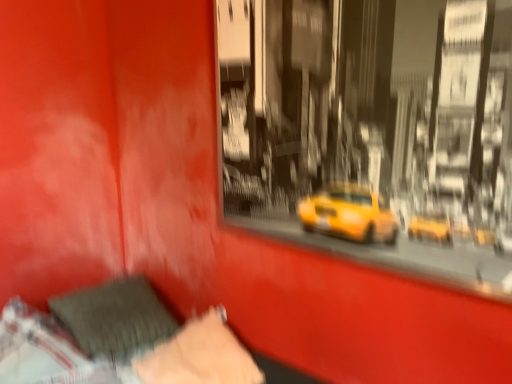
The width and height of the screenshot is (512, 384). What do you see at coordinates (118, 341) in the screenshot?
I see `velvet-like gray pillow at lower left` at bounding box center [118, 341].

Measure the distance between velvety black pillow at lower left, positioned as the first pillow in right-to-left order, and camera.

velvety black pillow at lower left, positioned as the first pillow in right-to-left order, is 1.43 meters from camera.

What do you see at coordinates (200, 356) in the screenshot?
I see `velvety black pillow at lower left, positioned as the first pillow in right-to-left order` at bounding box center [200, 356].

I want to click on velvety gray pillow at lower left, positioned as the first pillow in left-to-right order, so click(115, 317).

Is velvety black pillow at lower left, positioned as the first pillow in right-to-left order, completely or partially outside of velvet-like gray pillow at lower left?

No, velvety black pillow at lower left, positioned as the first pillow in right-to-left order, is inside velvet-like gray pillow at lower left's boundary.

Looking at this image, how many degrees apart are the facing directions of velvety black pillow at lower left, marked as the 2th pillow in a left-to-right arrangement, and velvet-like gray pillow at lower left?

The angle between the facing direction of velvety black pillow at lower left, marked as the 2th pillow in a left-to-right arrangement, and the facing direction of velvet-like gray pillow at lower left is 81.2 degrees.

Is velvety black pillow at lower left, marked as the 2th pillow in a left-to-right arrangement, in front of or behind velvet-like gray pillow at lower left in the image?

Clearly, velvety black pillow at lower left, marked as the 2th pillow in a left-to-right arrangement, is behind velvet-like gray pillow at lower left.

From the image's perspective, who appears lower, velvety black pillow at lower left, positioned as the first pillow in right-to-left order, or velvet-like gray pillow at lower left?

velvet-like gray pillow at lower left is shown below in the image.

Is velvety gray pillow at lower left, the second pillow in the right-to-left sequence, placed right next to velvety black pillow at lower left, positioned as the first pillow in right-to-left order?

No, velvety gray pillow at lower left, the second pillow in the right-to-left sequence, is not beside velvety black pillow at lower left, positioned as the first pillow in right-to-left order.

Consider the image. Which is in front, velvety gray pillow at lower left, the second pillow in the right-to-left sequence, or velvety black pillow at lower left, marked as the 2th pillow in a left-to-right arrangement?

velvety black pillow at lower left, marked as the 2th pillow in a left-to-right arrangement, is closer to the camera.

Is point (155, 322) behind point (255, 378)?

Yes, point (155, 322) is behind point (255, 378).

Between velvety gray pillow at lower left, the second pillow in the right-to-left sequence, and velvety black pillow at lower left, marked as the 2th pillow in a left-to-right arrangement, which one appears on the right side from the viewer's perspective?

velvety black pillow at lower left, marked as the 2th pillow in a left-to-right arrangement, is more to the right.

In the scene shown: Is velvet-like gray pillow at lower left oriented towards velvety gray pillow at lower left, positioned as the first pillow in left-to-right order?

No, velvet-like gray pillow at lower left is not turned towards velvety gray pillow at lower left, positioned as the first pillow in left-to-right order.

Between velvet-like gray pillow at lower left and velvety gray pillow at lower left, the second pillow in the right-to-left sequence, which one has smaller width?

velvety gray pillow at lower left, the second pillow in the right-to-left sequence, is thinner.

Is velvet-like gray pillow at lower left at the right side of velvety gray pillow at lower left, positioned as the first pillow in left-to-right order?

Yes, velvet-like gray pillow at lower left is to the right of velvety gray pillow at lower left, positioned as the first pillow in left-to-right order.

Is velvety gray pillow at lower left, the second pillow in the right-to-left sequence, to the left or to the right of velvet-like gray pillow at lower left in the image?

Based on their positions, velvety gray pillow at lower left, the second pillow in the right-to-left sequence, is located to the left of velvet-like gray pillow at lower left.

Where is `bed in front of the velvety gray pillow at lower left, the second pillow in the right-to-left sequence`? The width and height of the screenshot is (512, 384). bed in front of the velvety gray pillow at lower left, the second pillow in the right-to-left sequence is located at coordinates (118, 341).

Is point (122, 279) closer or farther from the camera than point (25, 321)?

Point (122, 279) is farther from the camera than point (25, 321).

Who is bigger, velvety gray pillow at lower left, the second pillow in the right-to-left sequence, or velvet-like gray pillow at lower left?

With larger size is velvet-like gray pillow at lower left.

Is velvet-like gray pillow at lower left far from velvety black pillow at lower left, marked as the 2th pillow in a left-to-right arrangement?

No, velvet-like gray pillow at lower left is in close proximity to velvety black pillow at lower left, marked as the 2th pillow in a left-to-right arrangement.

Does velvet-like gray pillow at lower left have a greater width compared to velvety black pillow at lower left, marked as the 2th pillow in a left-to-right arrangement?

Correct, the width of velvet-like gray pillow at lower left exceeds that of velvety black pillow at lower left, marked as the 2th pillow in a left-to-right arrangement.

Find the location of a particular element. Image resolution: width=512 pixels, height=384 pixels. bed located above the velvety black pillow at lower left, marked as the 2th pillow in a left-to-right arrangement (from a real-world perspective) is located at coordinates (118, 341).

Which is more to the right, velvet-like gray pillow at lower left or velvety black pillow at lower left, marked as the 2th pillow in a left-to-right arrangement?

velvety black pillow at lower left, marked as the 2th pillow in a left-to-right arrangement, is more to the right.

Looking at the image, does velvety black pillow at lower left, marked as the 2th pillow in a left-to-right arrangement, seem bigger or smaller compared to velvety gray pillow at lower left, positioned as the first pillow in left-to-right order?

Clearly, velvety black pillow at lower left, marked as the 2th pillow in a left-to-right arrangement, is smaller in size than velvety gray pillow at lower left, positioned as the first pillow in left-to-right order.

Measure the distance between velvety black pillow at lower left, marked as the 2th pillow in a left-to-right arrangement, and velvety gray pillow at lower left, positioned as the first pillow in left-to-right order.

9.80 inches.

From a real-world perspective, does velvety black pillow at lower left, marked as the 2th pillow in a left-to-right arrangement, stand above velvety gray pillow at lower left, the second pillow in the right-to-left sequence?

No.

Is velvety black pillow at lower left, marked as the 2th pillow in a left-to-right arrangement, far away from velvety gray pillow at lower left, positioned as the first pillow in left-to-right order?

That's not correct — velvety black pillow at lower left, marked as the 2th pillow in a left-to-right arrangement, is a little close to velvety gray pillow at lower left, positioned as the first pillow in left-to-right order.

In order to click on pillow that is the 1st one when counting upward from the velvet-like gray pillow at lower left (from the image's perspective) in this screenshot , I will do `click(200, 356)`.

Locate an element on the screen. Image resolution: width=512 pixels, height=384 pixels. pillow lying in front of the velvety gray pillow at lower left, positioned as the first pillow in left-to-right order is located at coordinates (200, 356).

Based on their spatial positions, is velvet-like gray pillow at lower left or velvety gray pillow at lower left, the second pillow in the right-to-left sequence, closer to velvety black pillow at lower left, positioned as the first pillow in right-to-left order?

velvet-like gray pillow at lower left is positioned closer to the anchor velvety black pillow at lower left, positioned as the first pillow in right-to-left order.

Considering their positions, is velvety gray pillow at lower left, positioned as the first pillow in left-to-right order, positioned further to velvety black pillow at lower left, marked as the 2th pillow in a left-to-right arrangement, than velvet-like gray pillow at lower left?

velvety gray pillow at lower left, positioned as the first pillow in left-to-right order.

From the image, which object appears to be nearer to velvety gray pillow at lower left, positioned as the first pillow in left-to-right order, velvety black pillow at lower left, marked as the 2th pillow in a left-to-right arrangement, or velvet-like gray pillow at lower left?

The object closer to velvety gray pillow at lower left, positioned as the first pillow in left-to-right order, is velvet-like gray pillow at lower left.

Based on their spatial positions, is velvety gray pillow at lower left, positioned as the first pillow in left-to-right order, or velvety black pillow at lower left, marked as the 2th pillow in a left-to-right arrangement, closer to velvet-like gray pillow at lower left?

The object closer to velvet-like gray pillow at lower left is velvety gray pillow at lower left, positioned as the first pillow in left-to-right order.

Considering their positions, is velvet-like gray pillow at lower left positioned closer to velvety gray pillow at lower left, positioned as the first pillow in left-to-right order, than velvety black pillow at lower left, marked as the 2th pillow in a left-to-right arrangement?

Based on the image, velvet-like gray pillow at lower left appears to be nearer to velvety gray pillow at lower left, positioned as the first pillow in left-to-right order.

Which object lies nearer to the anchor point velvet-like gray pillow at lower left, velvety black pillow at lower left, marked as the 2th pillow in a left-to-right arrangement, or velvety gray pillow at lower left, the second pillow in the right-to-left sequence?

velvety gray pillow at lower left, the second pillow in the right-to-left sequence, is positioned closer to the anchor velvet-like gray pillow at lower left.

You are a GUI agent. You are given a task and a screenshot of the screen. Output one action in this format:
    pyautogui.click(x=<x>, y=<y>)
    Task: Click on the pillow positioned between velvet-like gray pillow at lower left and velvety gray pillow at lower left, positioned as the first pillow in left-to-right order, from near to far
    
    Given the screenshot: What is the action you would take?
    pyautogui.click(x=200, y=356)